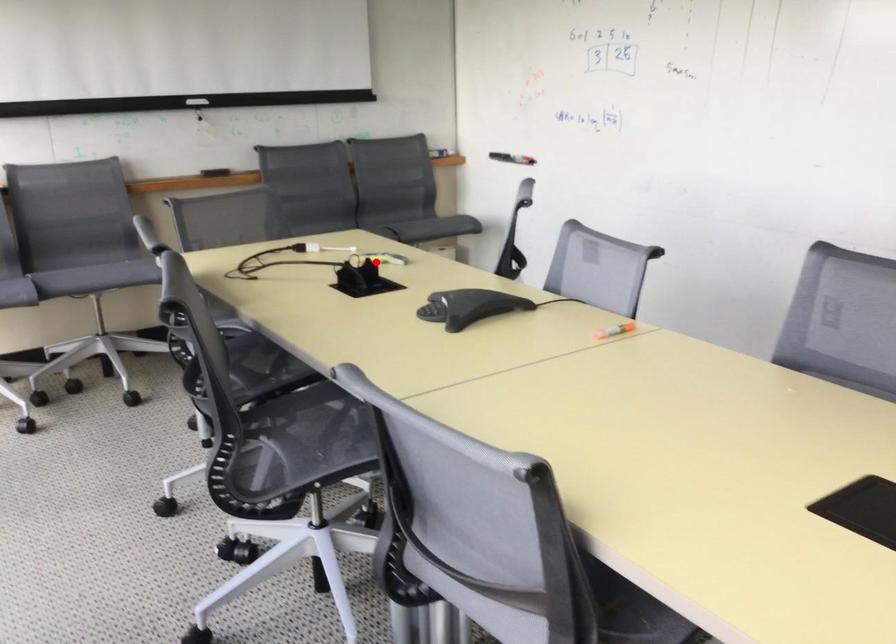
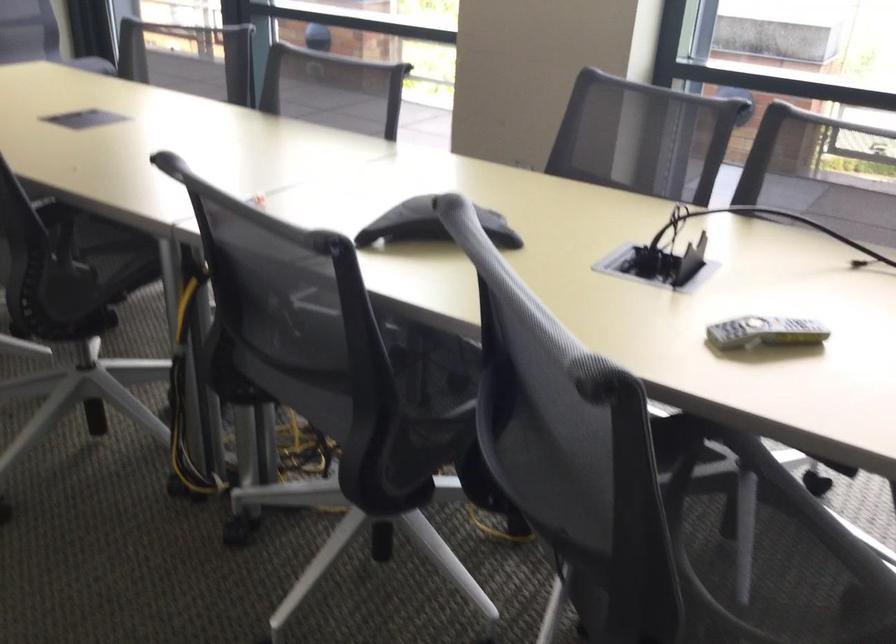
Find the pixel in the second image that matches the highlighted location in the first image.

(764, 332)